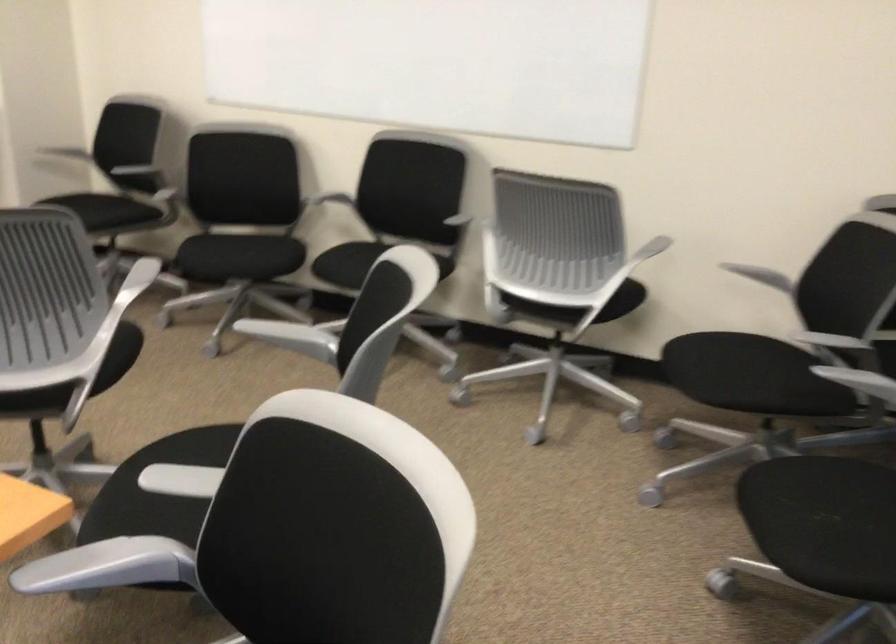
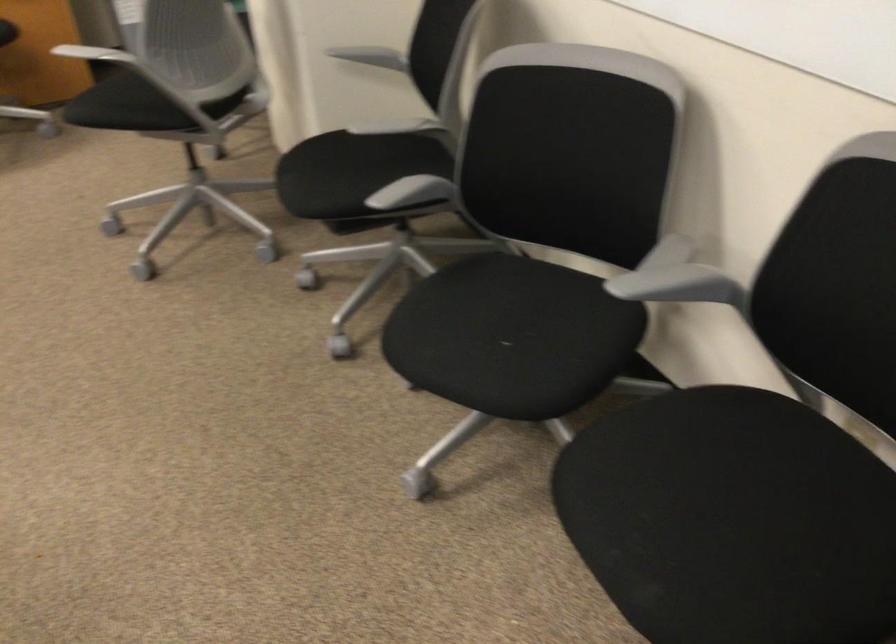
Locate, in the second image, the point that corresponds to (x=81, y=210) in the first image.

(319, 176)